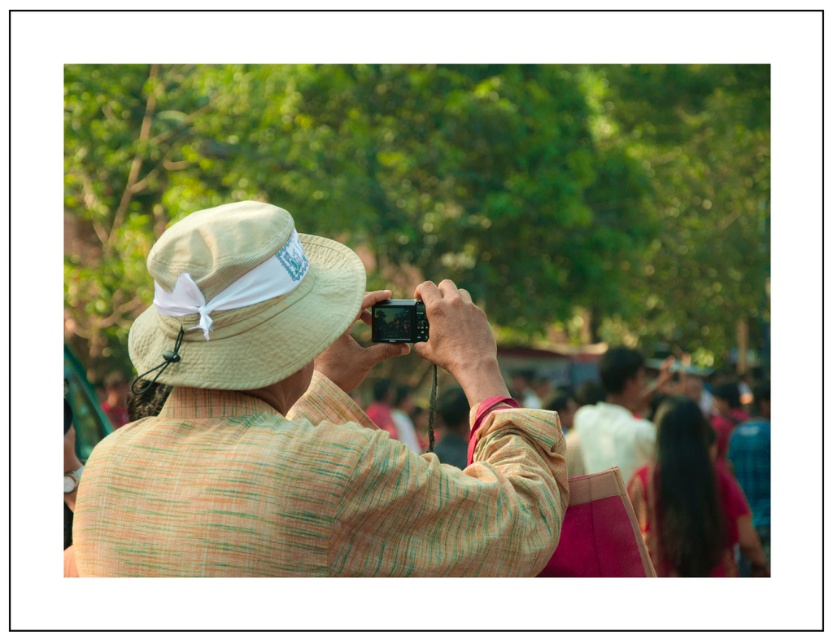
Who is taller, white cotton shirt at center or matte black camera at center?

white cotton shirt at center

Locate an element on the screen. Image resolution: width=833 pixels, height=640 pixels. white cotton shirt at center is located at coordinates (616, 417).

Which is in front, point (632, 472) or point (417, 308)?

Positioned in front is point (417, 308).

The height and width of the screenshot is (640, 833). In order to click on white cotton shirt at center in this screenshot , I will do `click(616, 417)`.

Is textured beige hat at center further to the viewer compared to beige straw hat at center?

No.

At what (x,y) coordinates should I click in order to perform the action: click on textured beige hat at center. Please return your answer as a coordinate pair (x, y). This screenshot has height=640, width=833. Looking at the image, I should click on (293, 433).

Where is `textured beige hat at center`? textured beige hat at center is located at coordinates (293, 433).

Does point (297, 316) come in front of point (402, 317)?

Yes, it is in front of point (402, 317).

Can you confirm if beige straw hat at center is wider than matte black camera at center?

Yes, beige straw hat at center is wider than matte black camera at center.

This screenshot has height=640, width=833. Find the location of `beige straw hat at center`. beige straw hat at center is located at coordinates (242, 298).